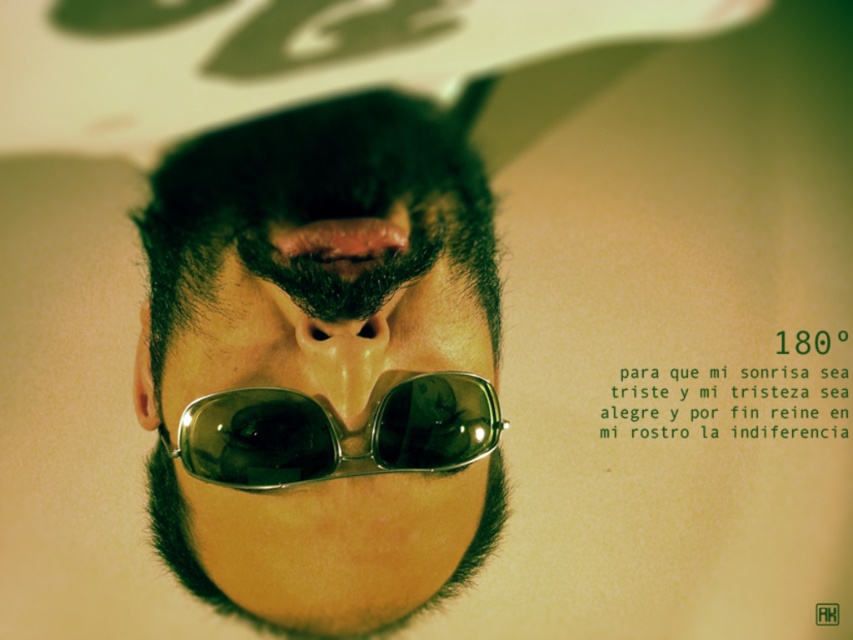
You are a photographer adjusting the focus on your camera. You notice two central features in the frame, the smokey gray metallic goggles at center and the matte brown nose at center. Which object is positioned to the left in the image?

The smokey gray metallic goggles at center are to the left of the matte brown nose at center according to the description.

You are an artist sketching this portrait. You need to draw the shiny metallic sunglasses at center and the matte brown nose at center. Which object should you draw first if you want to follow the standard left to right drawing technique?

You should draw the shiny metallic sunglasses at center first because it is positioned to the left of the matte brown nose at center, and the standard left to right drawing technique starts with the leftmost object.